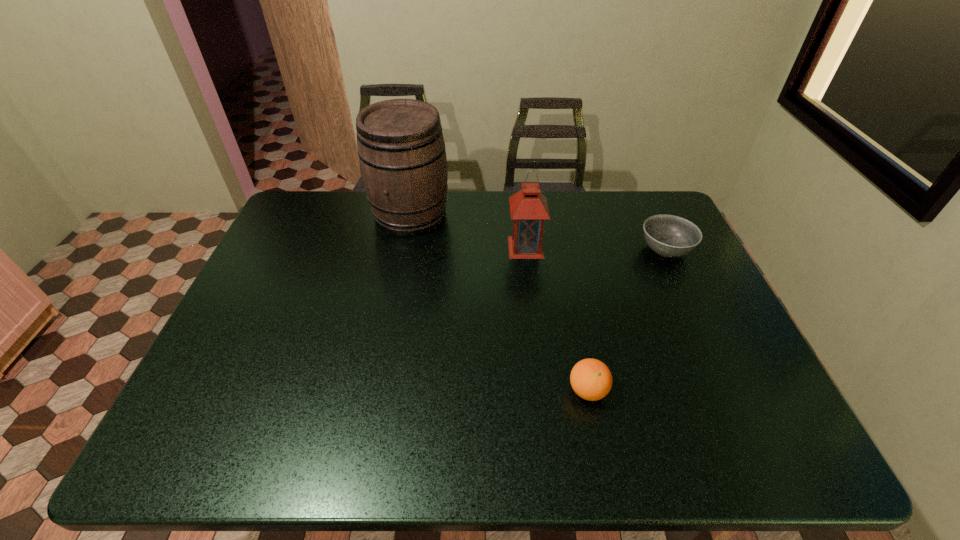
The image size is (960, 540). I want to click on blank area located 0.080m on the left of the bowl, so click(x=612, y=250).

The width and height of the screenshot is (960, 540). In order to click on object situated at the far edge in this screenshot , I will do `click(401, 148)`.

Where is `object located at the right edge`? The image size is (960, 540). object located at the right edge is located at coordinates (667, 235).

Where is `vacant space at the far edge`? vacant space at the far edge is located at coordinates (489, 206).

This screenshot has width=960, height=540. Find the location of `vacant space at the near edge`. vacant space at the near edge is located at coordinates (282, 461).

You are a GUI agent. You are given a task and a screenshot of the screen. Output one action in this format:
    pyautogui.click(x=<x>, y=<y>)
    Task: Click on the blank space at the left edge
    
    Given the screenshot: What is the action you would take?
    pyautogui.click(x=255, y=330)

What are the coordinates of `vacant space at the right edge` in the screenshot? It's located at coord(690,285).

At what (x,y) coordinates should I click in order to perform the action: click on free location at the near left corner. Please return your answer as a coordinate pair (x, y). Image resolution: width=960 pixels, height=540 pixels. Looking at the image, I should click on 204,458.

The width and height of the screenshot is (960, 540). In order to click on vacant space at the near right corner of the desktop in this screenshot , I will do `click(767, 444)`.

In order to click on blank region between the third shortest object and the bowl in this screenshot , I will do `click(595, 248)`.